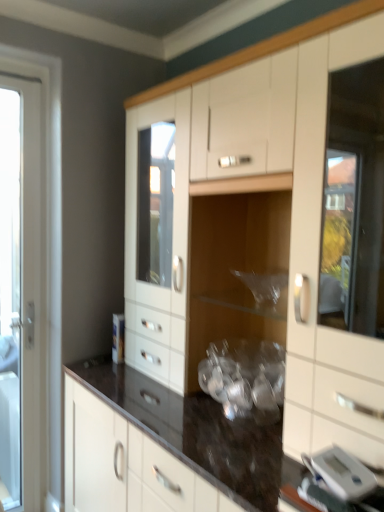
Question: Visually, is silver metallic digital clock at lower right positioned to the left or to the right of white glossy door at left?

Choices:
 (A) left
 (B) right

Answer: (B)

Question: Looking at their shapes, would you say silver metallic digital clock at lower right is wider or thinner than white glossy door at left?

Choices:
 (A) thin
 (B) wide

Answer: (B)

Question: Which object is positioned farthest from the white glossy door at left?

Choices:
 (A) silver metallic digital clock at lower right
 (B) white glossy cabinet at center

Answer: (A)

Question: Considering the real-world distances, which object is farthest from the silver metallic digital clock at lower right?

Choices:
 (A) white glossy door at left
 (B) white glossy cabinet at center

Answer: (A)